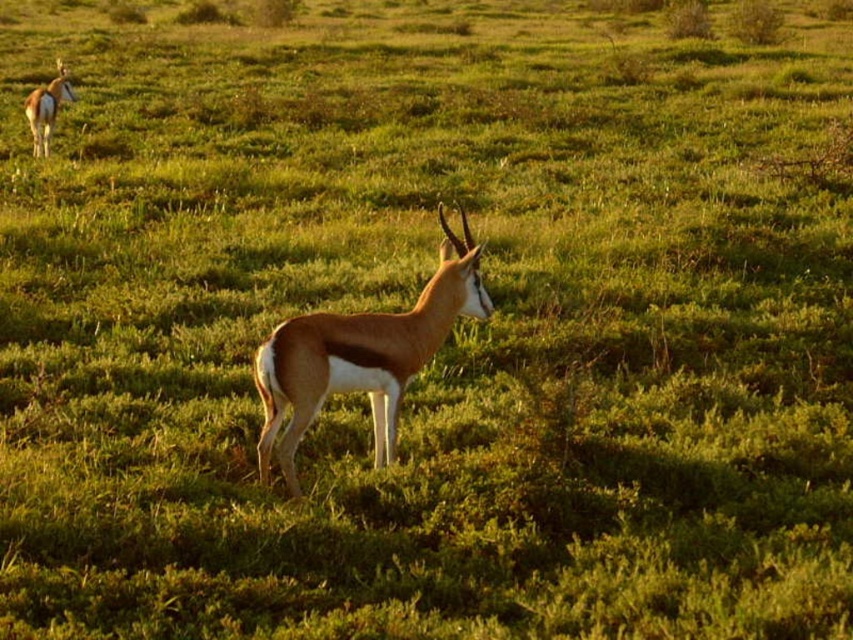
Question: Which object is farther from the camera taking this photo?

Choices:
 (A) brown glossy antelope at upper left
 (B) brown glossy antelope at center

Answer: (A)

Question: Can you confirm if brown glossy antelope at center is positioned above brown glossy antelope at upper left?

Choices:
 (A) yes
 (B) no

Answer: (B)

Question: Among these points, which one is farthest from the camera?

Choices:
 (A) (38, 138)
 (B) (431, 342)

Answer: (A)

Question: Does brown glossy antelope at center have a smaller size compared to brown glossy antelope at upper left?

Choices:
 (A) no
 (B) yes

Answer: (A)

Question: Is brown glossy antelope at center to the left of brown glossy antelope at upper left from the viewer's perspective?

Choices:
 (A) no
 (B) yes

Answer: (A)